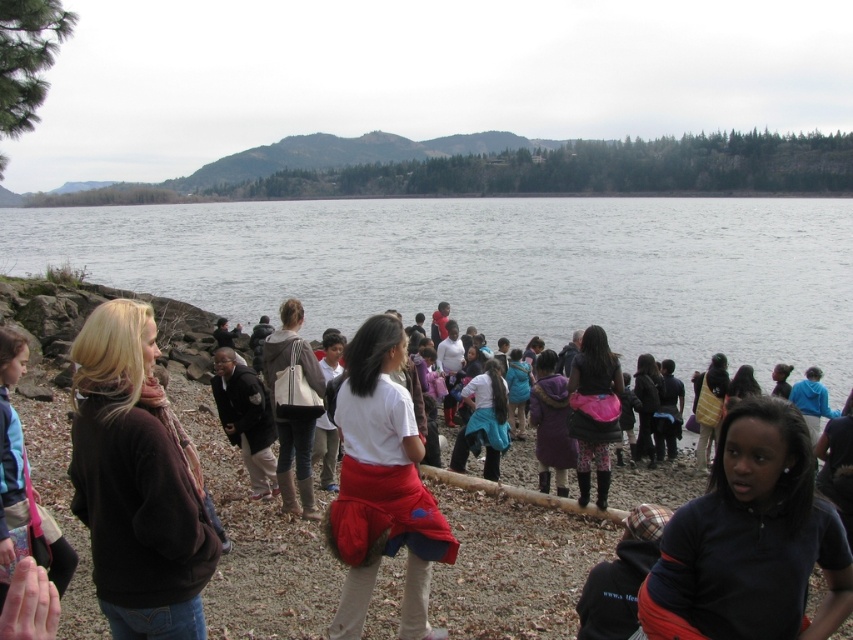
You are standing at the shoreline and want to move from point A to point B. Given that point A is at coordinates point (x=397, y=259) and point B is at coordinates point (x=606, y=404), will you have to walk towards the background or towards the foreground to reach your destination?

You will have to walk towards the background to reach point B at coordinates point (x=606, y=404) because point A at coordinates point (x=397, y=259) is closer to you, meaning point B is further away in the background.

You are standing on the rocky shoreline and want to cross to the other side of the gray water at center. To your right, there is a path leading away from the matte white shirt at center. Which direction should you head to avoid getting your boots wet?

The gray water at center is to the left of the matte white shirt at center. To avoid getting your boots wet, you should head to the right, away from the gray water at center, following the path that leads away from the matte white shirt at center.

You are a photographer positioned at the camera location. You want to capture a closeup shot of the black matte shirt at lower right without moving closer than 15 feet. Is it possible to do so with your current equipment?

The black matte shirt at lower right is 17.25 feet away from camera. Since you cannot move closer than 15 feet, you are currently 2.25 feet beyond the minimum distance required. Therefore, you can capture the closeup shot without moving closer.